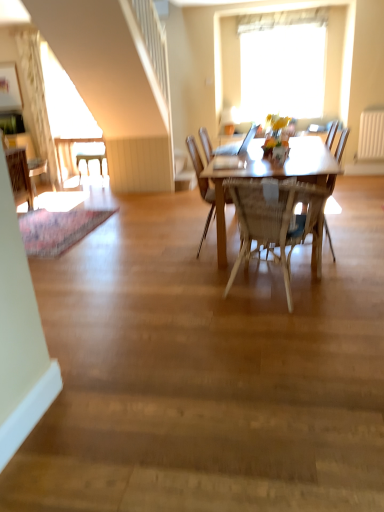
Question: Considering the relative sizes of woven wood chair at center, acting as the fourth chair starting from the left, and white plastic chair at left, the 3th chair viewed from the left, in the image provided, is woven wood chair at center, acting as the fourth chair starting from the left, shorter than white plastic chair at left, the 3th chair viewed from the left,?

Choices:
 (A) no
 (B) yes

Answer: (A)

Question: Does woven wood chair at center, marked as the 5th chair in a back-to-front arrangement, turn towards white plastic chair at left, which is counted as the 1th chair, starting from the back?

Choices:
 (A) yes
 (B) no

Answer: (B)

Question: Is woven wood chair at center, which appears as the 1th chair when viewed from the front, at the right side of white plastic chair at left, arranged as the 3th chair when viewed from the right?

Choices:
 (A) yes
 (B) no

Answer: (A)

Question: Is woven wood chair at center, acting as the fourth chair starting from the left, next to white plastic chair at left, the 3th chair viewed from the left?

Choices:
 (A) no
 (B) yes

Answer: (A)

Question: Is woven wood chair at center, the 2th chair viewed from the right, wider than white plastic chair at left, arranged as the 3th chair when viewed from the right?

Choices:
 (A) yes
 (B) no

Answer: (A)

Question: Is woven wood chair at center, the 2th chair viewed from the right, at the left side of white plastic chair at left, which is counted as the 1th chair, starting from the back?

Choices:
 (A) yes
 (B) no

Answer: (B)

Question: Is the position of white glossy desk at left more distant than that of light beige textured curtain at upper left?

Choices:
 (A) yes
 (B) no

Answer: (A)

Question: Does white glossy desk at left have a greater width compared to light beige textured curtain at upper left?

Choices:
 (A) no
 (B) yes

Answer: (B)

Question: From a real-world perspective, is white glossy desk at left below light beige textured curtain at upper left?

Choices:
 (A) no
 (B) yes

Answer: (B)

Question: Is light beige textured curtain at upper left completely or partially inside white glossy desk at left?

Choices:
 (A) no
 (B) yes

Answer: (A)

Question: Is white glossy desk at left taller than light beige textured curtain at upper left?

Choices:
 (A) no
 (B) yes

Answer: (A)

Question: Is white glossy desk at left facing towards light beige textured curtain at upper left?

Choices:
 (A) yes
 (B) no

Answer: (B)

Question: Is the position of wooden chair at left, the 4th chair positioned from the front, less distant than that of matte white vase at center?

Choices:
 (A) no
 (B) yes

Answer: (A)